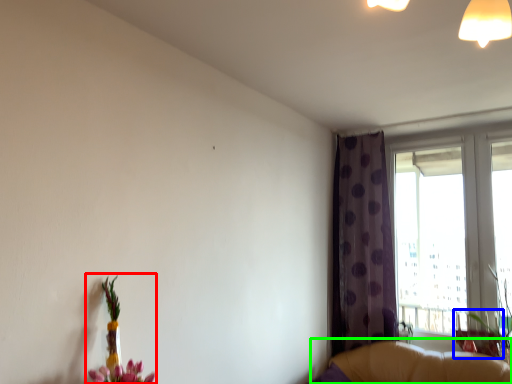
Question: Which is nearer to the floral arrangement (highlighted by a red box)? swivel chair (highlighted by a blue box) or couch (highlighted by a green box).

Choices:
 (A) swivel chair
 (B) couch

Answer: (B)